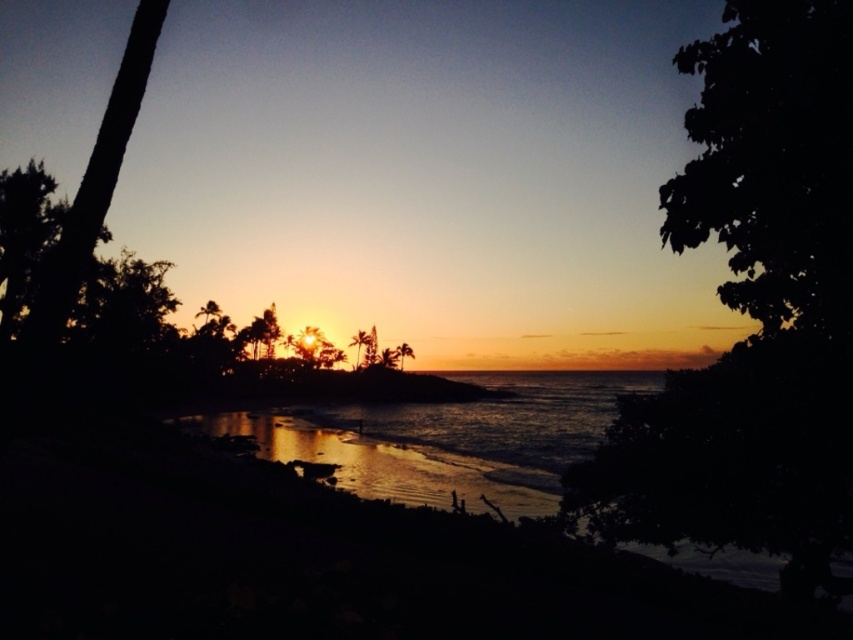
From the picture: You are standing on the shoreline in the sunset scene and want to take a photo of the dark green leafy tree at upper right. To do this, you need to position yourself so that the tree is centered in your camera viewfinder. Given that your current position is at the shoreline, which direction should you move to align the tree at point (772, 163) in the image? Please specify the direction as left, right, forward, or backward.

To center the dark green leafy tree at upper right represented by point (772, 163), you should move to the right. This adjustment will align the tree properly in your camera viewfinder.

You are standing on the shore and want to take a photo of both the dark green leafy tree at upper right and the green leafy palm tree at center. Which tree should you focus on first to ensure both are in clear view?

You should focus on the dark green leafy tree at upper right first because it is closer to you than the green leafy palm tree at center, so adjusting focus from near to far will help capture both clearly.